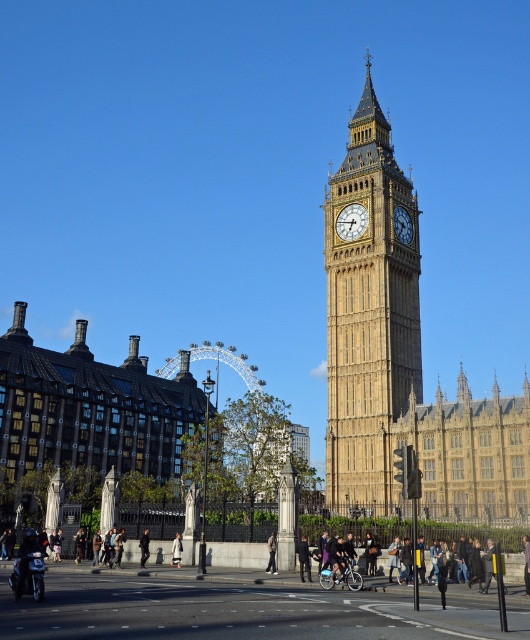
Is point (373, 195) positioned before point (527, 550)?

No.

Who is lower down, golden stone clock tower at center or denim jacket at center?

Positioned lower is denim jacket at center.

What do you see at coordinates (368, 314) in the screenshot?
I see `golden stone clock tower at center` at bounding box center [368, 314].

Image resolution: width=530 pixels, height=640 pixels. In order to click on golden stone clock tower at center in this screenshot , I will do `click(368, 314)`.

Is dark brown stone building at lower left to the right of dark brown leather jacket at lower left from the viewer's perspective?

In fact, dark brown stone building at lower left is to the left of dark brown leather jacket at lower left.

Can you confirm if dark brown stone building at lower left is thinner than dark brown leather jacket at lower left?

In fact, dark brown stone building at lower left might be wider than dark brown leather jacket at lower left.

This screenshot has width=530, height=640. Find the location of `dark brown stone building at lower left`. dark brown stone building at lower left is located at coordinates (90, 417).

Who is lower down, dark blue jeans at center or dark brown leather jacket at lower left?

dark brown leather jacket at lower left is below.

The height and width of the screenshot is (640, 530). Identify the location of dark blue jeans at center. (304, 557).